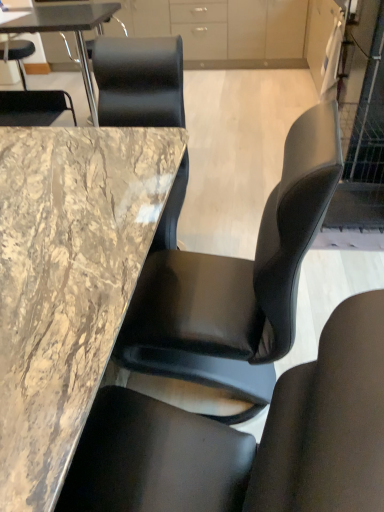
Question: Is black leather chair at center, positioned as the 1th chair in bottom-to-top order, oriented towards matte white cabinet at upper right, which is counted as the 1th cabinetry, starting from the front?

Choices:
 (A) yes
 (B) no

Answer: (B)

Question: From a real-world perspective, is black leather chair at center, placed as the 2th chair when sorted from top to bottom, located higher than matte white cabinet at upper right, which is counted as the first cabinetry, starting from the bottom?

Choices:
 (A) no
 (B) yes

Answer: (A)

Question: Can matte white cabinet at upper right, which is counted as the 1th cabinetry, starting from the front, be found inside black leather chair at center, the first chair in the front-to-back sequence?

Choices:
 (A) no
 (B) yes

Answer: (A)

Question: Is black leather chair at center, acting as the 1th chair starting from the right, further to camera compared to matte white cabinet at upper right, which is counted as the 1th cabinetry, starting from the front?

Choices:
 (A) yes
 (B) no

Answer: (B)

Question: Can you see black leather chair at center, the 2th chair in the left-to-right sequence, touching matte white cabinet at upper right, which is counted as the 1th cabinetry, starting from the front?

Choices:
 (A) yes
 (B) no

Answer: (B)

Question: From the image's perspective, is black leather chair at center, the first chair in the front-to-back sequence, beneath matte white cabinet at upper right, arranged as the first cabinetry when viewed from the right?

Choices:
 (A) yes
 (B) no

Answer: (A)

Question: Is matte white cabinet at upper right, which is counted as the first cabinetry, starting from the bottom, inside matte white cabinet at upper center, the second cabinetry in the front-to-back sequence?

Choices:
 (A) yes
 (B) no

Answer: (B)

Question: From the image's perspective, is matte white cabinet at upper center, the 1th cabinetry in the top-to-bottom sequence, on top of matte white cabinet at upper right, which is counted as the 1th cabinetry, starting from the front?

Choices:
 (A) yes
 (B) no

Answer: (A)

Question: Is matte white cabinet at upper center, which is the 1th cabinetry in left-to-right order, directly adjacent to matte white cabinet at upper right, the second cabinetry viewed from the top?

Choices:
 (A) no
 (B) yes

Answer: (A)

Question: Is matte white cabinet at upper center, which is the 1th cabinetry in left-to-right order, not inside matte white cabinet at upper right, arranged as the first cabinetry when viewed from the right?

Choices:
 (A) yes
 (B) no

Answer: (A)

Question: Does matte white cabinet at upper center, the 1th cabinetry in the back-to-front sequence, have a smaller size compared to matte white cabinet at upper right, the 2th cabinetry from the left?

Choices:
 (A) no
 (B) yes

Answer: (A)

Question: From a real-world perspective, is matte white cabinet at upper center, which appears as the second cabinetry when viewed from the right, on matte white cabinet at upper right, the second cabinetry viewed from the top?

Choices:
 (A) yes
 (B) no

Answer: (B)

Question: Is marble table at center, which appears as the first table when ordered from the bottom, located within black leather chair at center, acting as the 1th chair starting from the right?

Choices:
 (A) yes
 (B) no

Answer: (B)